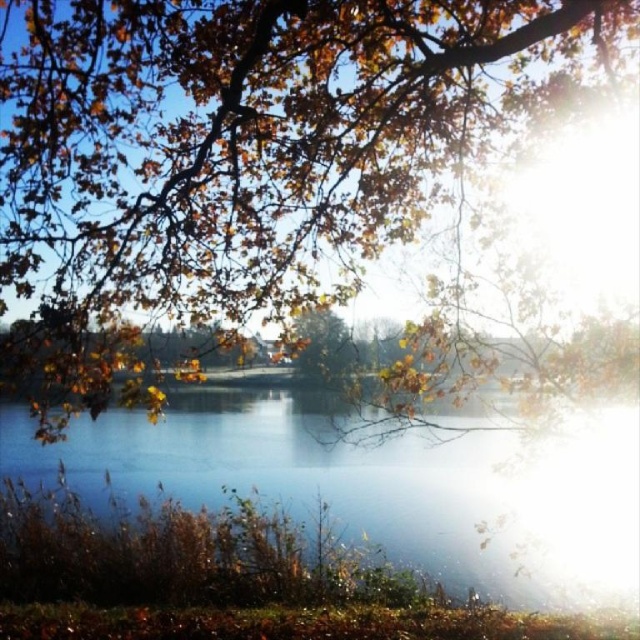
Question: Does golden leafy branches at upper center lie behind clear water at center?

Choices:
 (A) yes
 (B) no

Answer: (B)

Question: Which point is closer to the camera taking this photo?

Choices:
 (A) (356, 474)
 (B) (92, 349)

Answer: (B)

Question: Which of the following is the closest to the observer?

Choices:
 (A) (83, 17)
 (B) (292, 499)

Answer: (A)

Question: Does golden leafy branches at upper center appear on the right side of clear water at center?

Choices:
 (A) yes
 (B) no

Answer: (B)

Question: Does golden leafy branches at upper center appear over clear water at center?

Choices:
 (A) yes
 (B) no

Answer: (A)